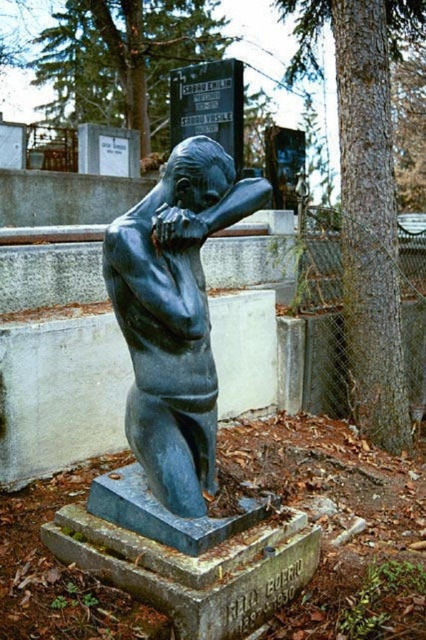
Question: Which point is farther to the camera?

Choices:
 (A) (158, 12)
 (B) (135, 268)
 (C) (370, 29)

Answer: (A)

Question: Which point appears farthest from the camera in this image?

Choices:
 (A) (83, 19)
 (B) (112, 280)

Answer: (A)

Question: In this image, where is smooth brown bark at center located relative to green textured tree at upper center?

Choices:
 (A) right
 (B) left

Answer: (A)

Question: Is smooth brown bark at center below green textured tree at upper center?

Choices:
 (A) no
 (B) yes

Answer: (B)

Question: Which point is closer to the camera?

Choices:
 (A) (176, 365)
 (B) (129, 29)

Answer: (A)

Question: Is bronze statue at center positioned in front of smooth brown bark at center?

Choices:
 (A) yes
 (B) no

Answer: (A)